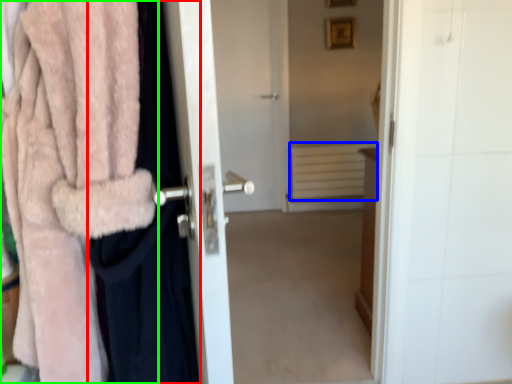
Question: Estimate the real-world distances between objects in this image. Which object is closer to clothing (highlighted by a red box), radiator (highlighted by a blue box) or towel (highlighted by a green box)?

Choices:
 (A) radiator
 (B) towel

Answer: (B)